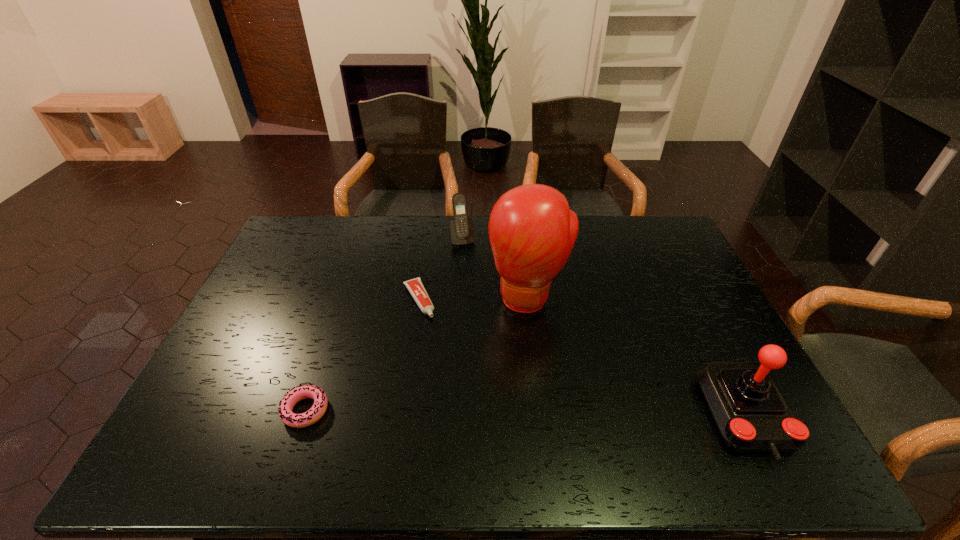
The image size is (960, 540). I want to click on free space between the toothpaste and the leftmost object, so click(x=362, y=355).

This screenshot has height=540, width=960. In order to click on empty space between the leftmost object and the cellular telephone in this screenshot , I will do `click(384, 325)`.

The height and width of the screenshot is (540, 960). I want to click on vacant area that lies between the joystick and the tallest object, so click(636, 357).

The width and height of the screenshot is (960, 540). I want to click on empty location between the doughnut and the second object from left to right, so click(x=362, y=355).

The width and height of the screenshot is (960, 540). I want to click on vacant region between the rightmost object and the farthest object, so click(604, 327).

Identify the location of vacant area between the boxing glove and the leftmost object. (417, 354).

You are a GUI agent. You are given a task and a screenshot of the screen. Output one action in this format:
    pyautogui.click(x=<x>, y=<y>)
    Task: Click on the free space between the toothpaste and the leftmost object
    This screenshot has width=960, height=540.
    Given the screenshot: What is the action you would take?
    pyautogui.click(x=362, y=355)

The height and width of the screenshot is (540, 960). What are the coordinates of `free space that is in between the rightmost object and the farthest object` in the screenshot? It's located at (604, 327).

Where is `vacant point located between the farthest object and the rightmost object`? vacant point located between the farthest object and the rightmost object is located at coordinates (604, 327).

The width and height of the screenshot is (960, 540). Find the location of `free space between the boxing glove and the doughnut`. free space between the boxing glove and the doughnut is located at coordinates click(417, 354).